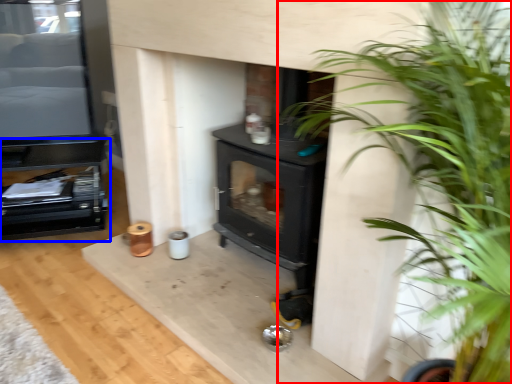
Question: Which point is further to the camera, houseplant (highlighted by a red box) or entertainment center (highlighted by a blue box)?

Choices:
 (A) houseplant
 (B) entertainment center

Answer: (B)